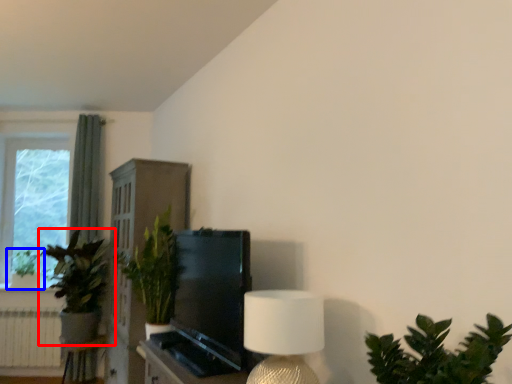
Question: Which of the following is the closest to the observer, houseplant (highlighted by a red box) or houseplant (highlighted by a blue box)?

Choices:
 (A) houseplant
 (B) houseplant

Answer: (A)